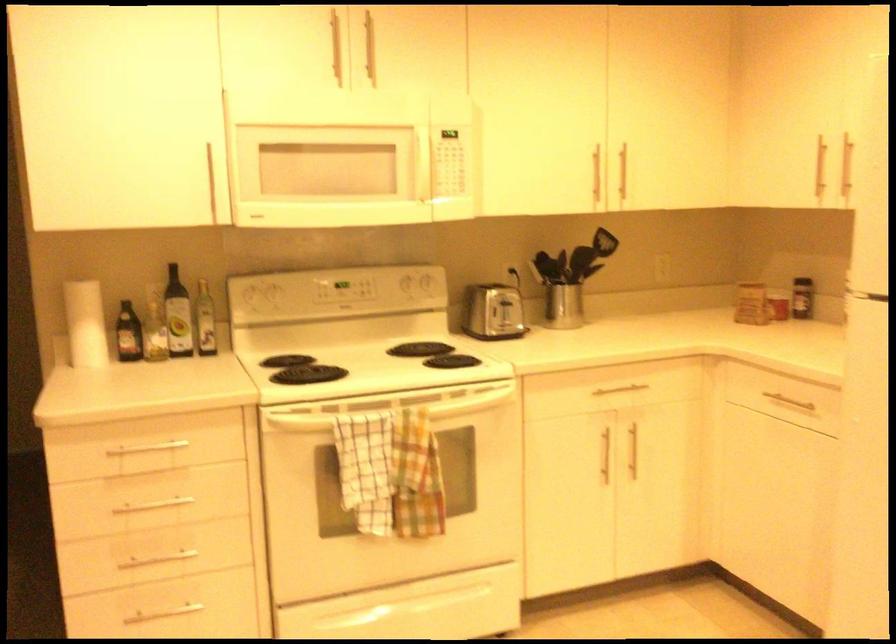
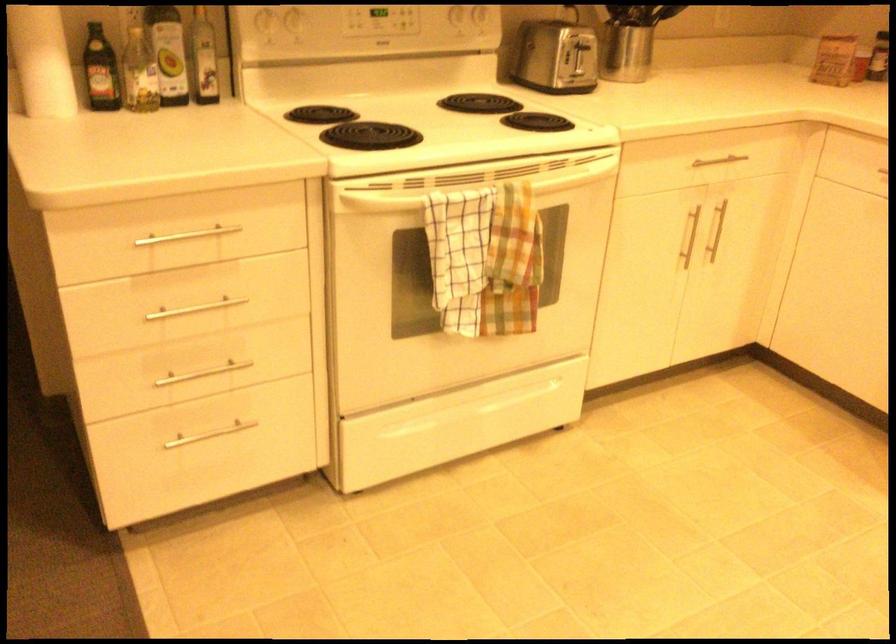
Locate, in the second image, the point that corresponds to the point at 657,390 in the first image.

(745, 164)